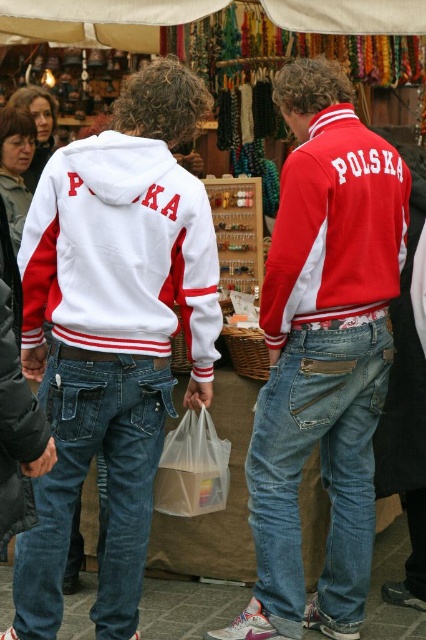
You are at a market stall and see two items displayed on a shelf. The items are denim at center and red matte jacket at center. Which item is positioned to the left when viewed from the front of the stall?

Denim at center is to the left of red matte jacket at center.

You are standing in the market and see two points marked in the image. Which point is closer to you, point (278, 563) or point (353, 273)?

Point (278, 563) is closer to you than point (353, 273).

You are a photographer trying to capture a clear shot of both the white matte sweatshirt at center and the denim at center in the market scene. Since you want both items to be visible equally, which object should you focus on first considering their sizes?

The white matte sweatshirt at center is larger in size than the denim at center, so you should focus on the denim at center first to ensure it is captured clearly alongside the larger sweatshirt.